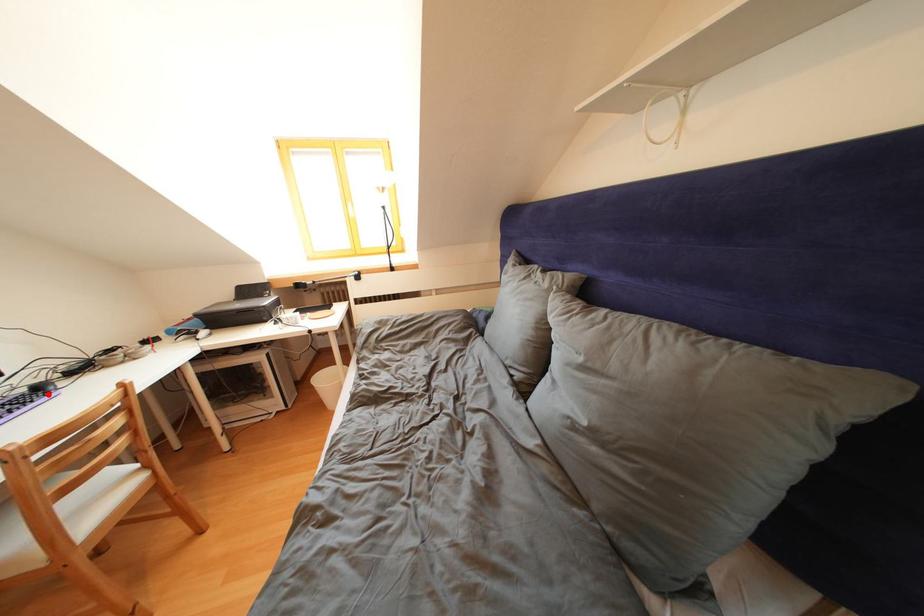
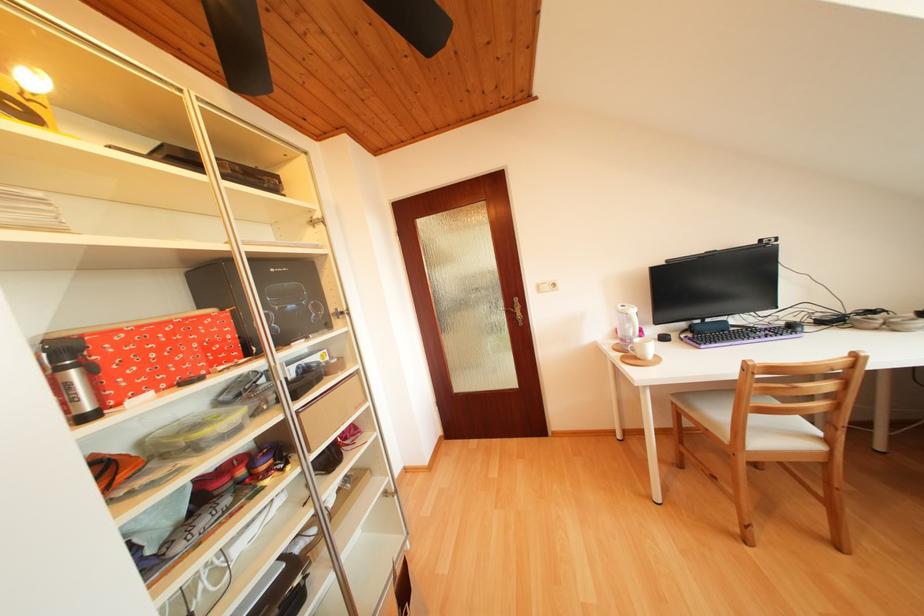
Where in the second image is the point corresponding to the highlighted location from the first image?

(799, 331)